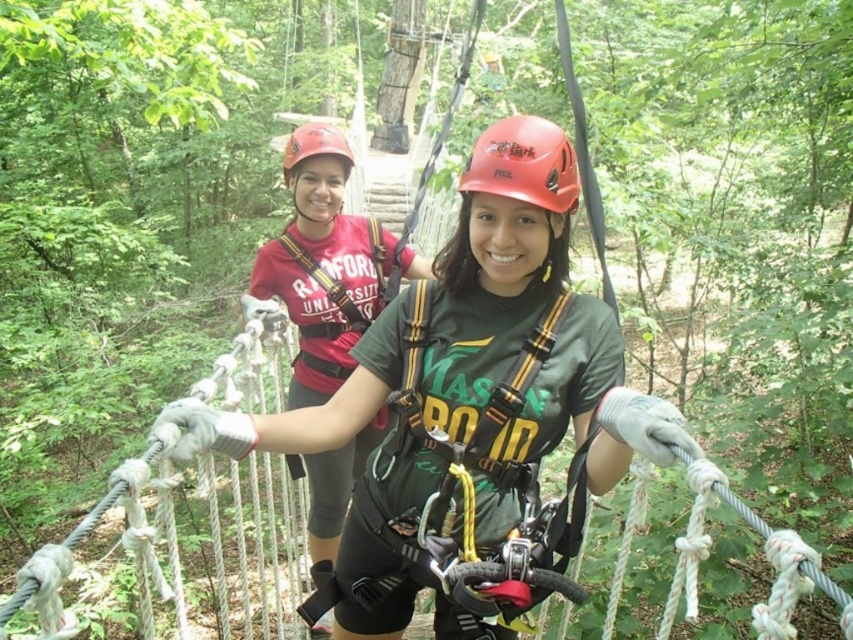
You are a safety inspector at the park and need to ensure that the distance between the two helmets is within the 5 feet safety regulation. Can you confirm if the distance between the matte orange helmet at center and the matte red helmet at upper center meets the requirement?

The matte orange helmet at center is 4.11 feet from the matte red helmet at upper center, which is within the 5 feet safety regulation requirement.

You are a park safety inspector checking the equipment placement in the image. The park requires that all helmets must be placed at least 0.3 units away from the edge of the platform, which is at point 0.2 units. Is the matte orange helmet at center positioned safely?

The matte orange helmet at center is located at point 0.256, which is 0.056 units away from the edge at 0.2. Since 0.056 is less than the required 0.3 units, the helmet is too close to the edge and not positioned safely.

You are an inspector checking safety distances between equipment at a ropes course. You notice two matte red helmets labeled at center and upper center in the image. According to safety regulations, the minimum required distance between any two pieces of equipment is 30 inches. Can the current distance between the matte red helmet at center and the matte red helmet at upper center meet the safety requirement?

The distance between the matte red helmet at center and the matte red helmet at upper center is 29.48 inches, which is less than the required 30 inches. Therefore, the current distance does not meet the safety requirement.